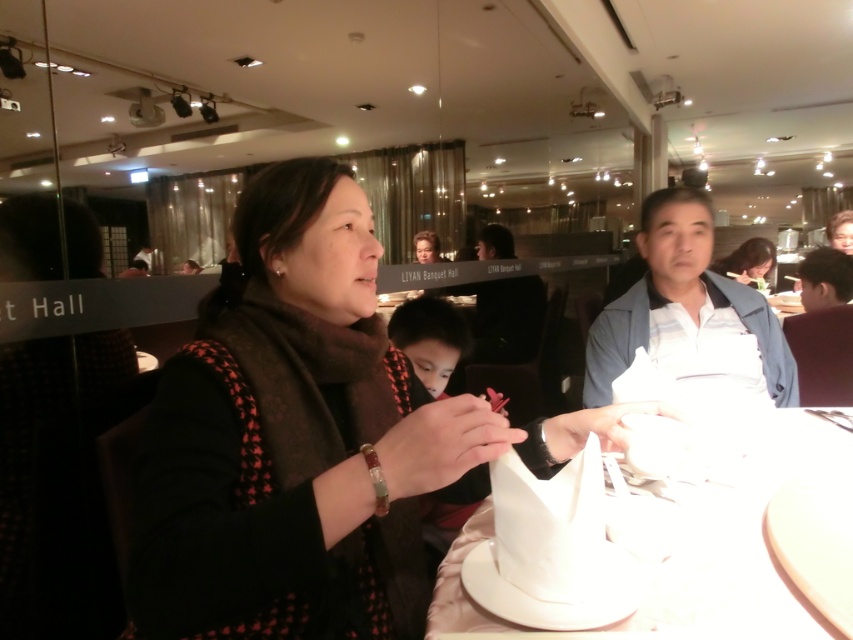
You are a server at the banquet hall and need to place a 30 cm long platter between the white paper plate at center and the light blue denim jacket at right. Can you fit it there?

The distance between the white paper plate at center and the light blue denim jacket at right is 45.75 centimeters. Since the platter is 30 cm long, it can easily fit in the space provided.

You are a photographer trying to capture a candid shot of the light blue denim jacket at right and the brown hair at upper right. Since you want to ensure both are in focus, you need to know which one is taller. Can you tell me which object is taller?

The light blue denim jacket at right has a greater height compared to the brown hair at upper right, so the light blue denim jacket at right is taller.